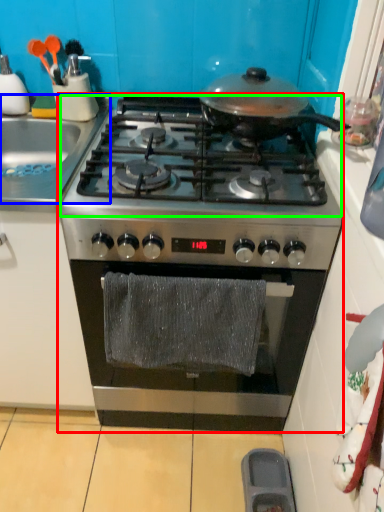
Question: Based on their relative distances, which object is farther from gas stove (highlighted by a red box)? Choose from sink (highlighted by a blue box) and gas stove (highlighted by a green box).

Choices:
 (A) sink
 (B) gas stove

Answer: (A)